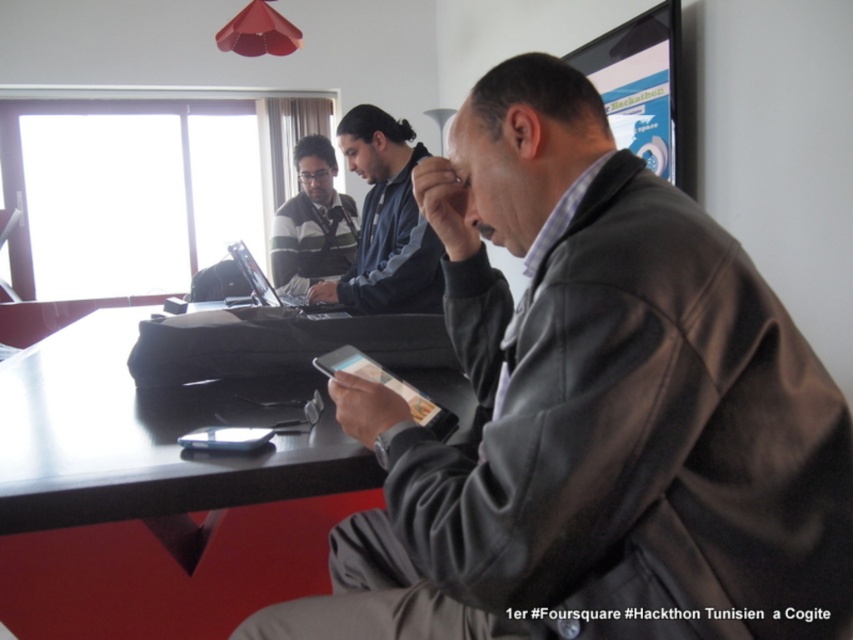
You are organizing a coat rack in the conference room. You have two items to hang up, the dark blue fleece at center and the striped sweater at center. Which item should you hang first if you want to place the smaller item on the lower hook?

The dark blue fleece at center should be hung first on the lower hook since it is smaller than the striped sweater at center.

You are organizing a clothing donation drive and need to stack items neatly. You have a dark brown leather jacket at center and a dark blue fleece at center. Based on their positions, which item should you place on top to ensure stability?

The dark brown leather jacket at center should be placed on top because it is positioned in front of the dark blue fleece at center, indicating it is closer to the viewer and thus more stable when stacked.

You are organizing a coat rack in the conference room and need to hang the dark brown leather jacket at center and the dark blue fleece at center. Which item requires a wider hanger based on their widths?

The dark brown leather jacket at center requires a wider hanger because its width surpasses that of the dark blue fleece at center.